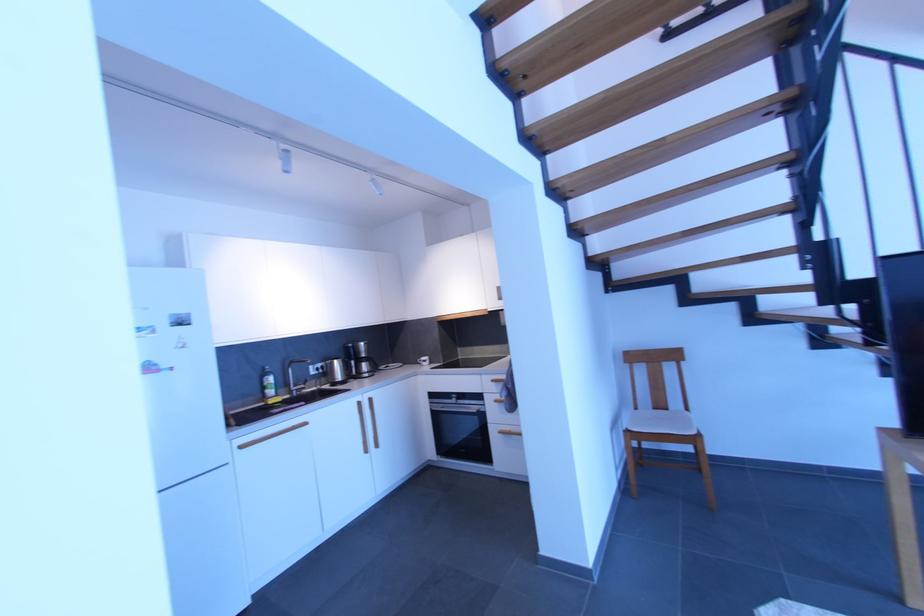
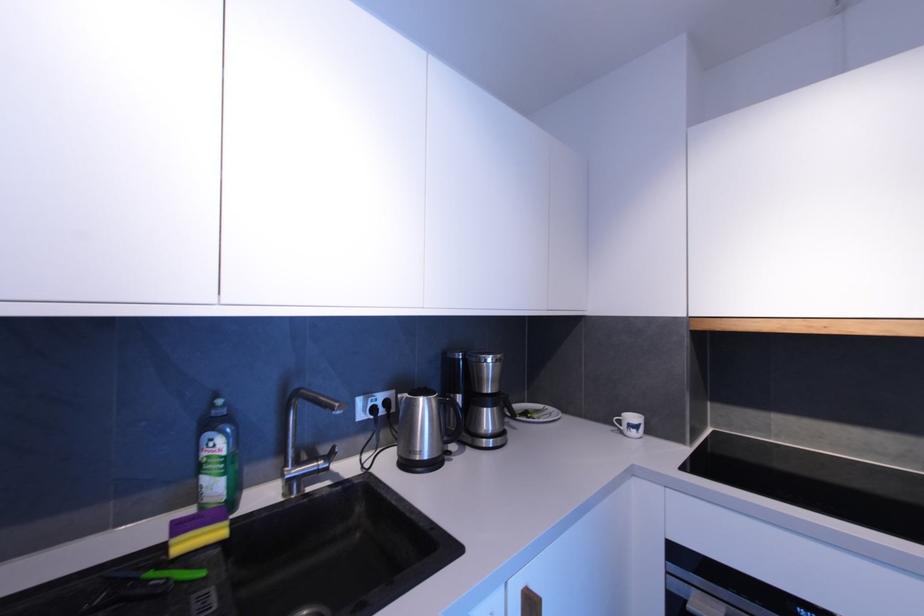
In the second image, find the point that corresponds to [307,387] in the first image.

(325, 464)